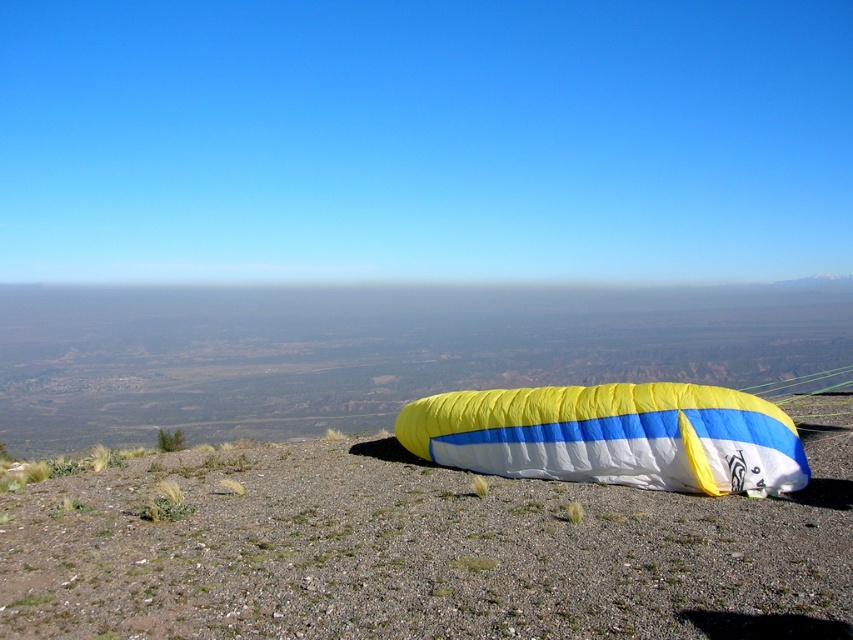
Is yellow fabric parachute at center bigger than yellow/white fabric parachute at lower right?

No, yellow fabric parachute at center is not bigger than yellow/white fabric parachute at lower right.

Who is more distant from viewer, [137,625] or [445,440]?

The point [445,440] is more distant.

This screenshot has width=853, height=640. Find the location of `yellow fabric parachute at center`. yellow fabric parachute at center is located at coordinates (425, 548).